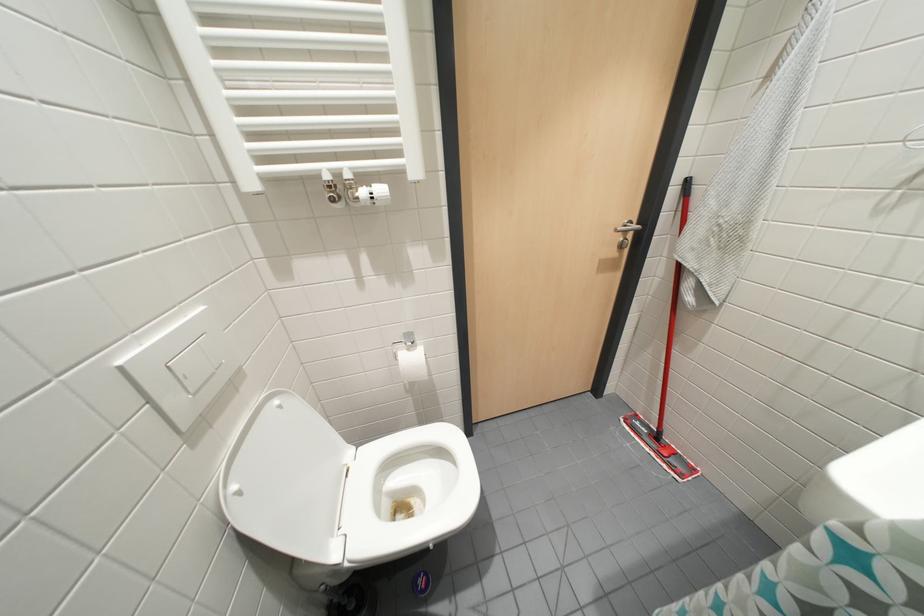
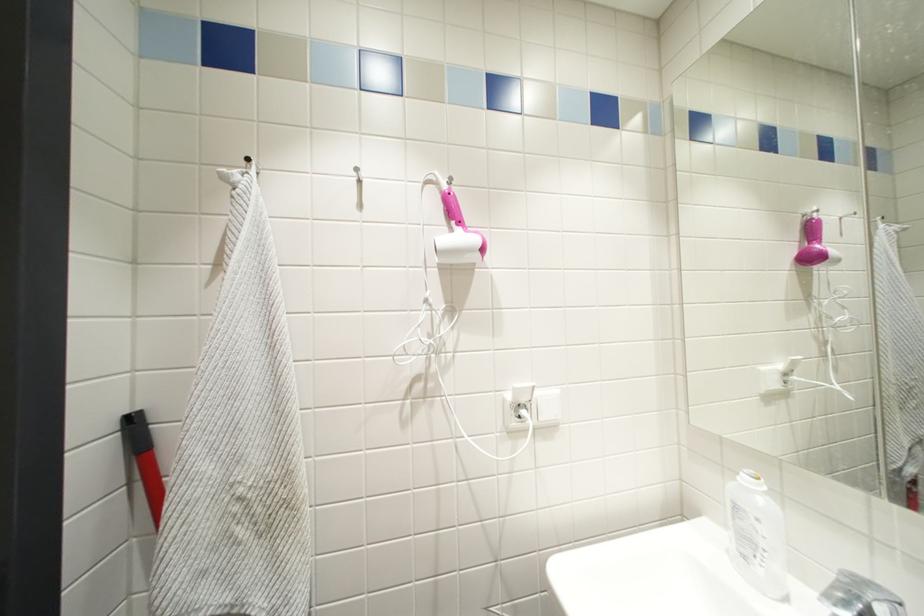
Question: The images are taken continuously from a first-person perspective. In which direction is your viewpoint rotating?

Choices:
 (A) Left
 (B) Right
 (C) Up
 (D) Down

Answer: (B)